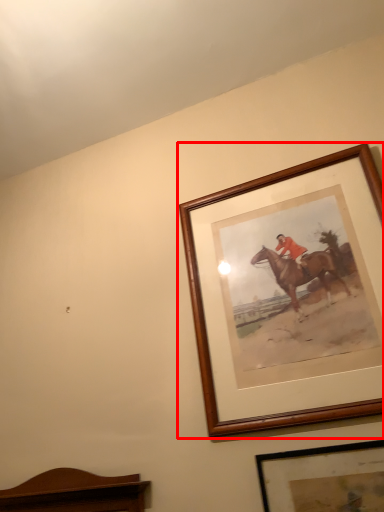
Question: From the image's perspective, what is the correct spatial positioning of picture frame (annotated by the red box) in reference to picture frame?

Choices:
 (A) above
 (B) below

Answer: (A)